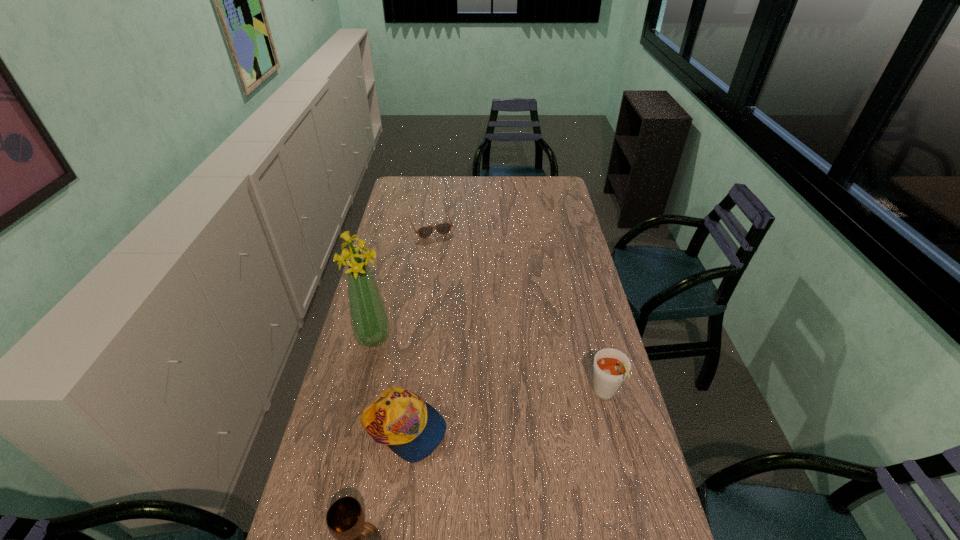
Locate an element on the screen. The height and width of the screenshot is (540, 960). the rightmost object is located at coordinates (611, 366).

Locate an element on the screen. The width and height of the screenshot is (960, 540). the second shortest object is located at coordinates (409, 426).

At what (x,y) coordinates should I click in order to perform the action: click on the tallest object. Please return your answer as a coordinate pair (x, y). The width and height of the screenshot is (960, 540). Looking at the image, I should click on (369, 318).

Where is `the fourth nearest object`? This screenshot has width=960, height=540. the fourth nearest object is located at coordinates (369, 318).

Find the location of `the shortest object`. the shortest object is located at coordinates (443, 228).

The height and width of the screenshot is (540, 960). What are the coordinates of `sunglasses` in the screenshot? It's located at (443, 228).

Identify the location of free space located 0.320m on the drink side of the rightmost object. The image size is (960, 540). (639, 534).

Locate an element on the screen. The image size is (960, 540). free space located 0.190m on the bill of the cap is located at coordinates (513, 441).

Find the location of `vacant region located on the bill of the cap`. vacant region located on the bill of the cap is located at coordinates (555, 447).

What are the coordinates of `vacant space located 0.390m on the bill of the cap` in the screenshot? It's located at coord(584,450).